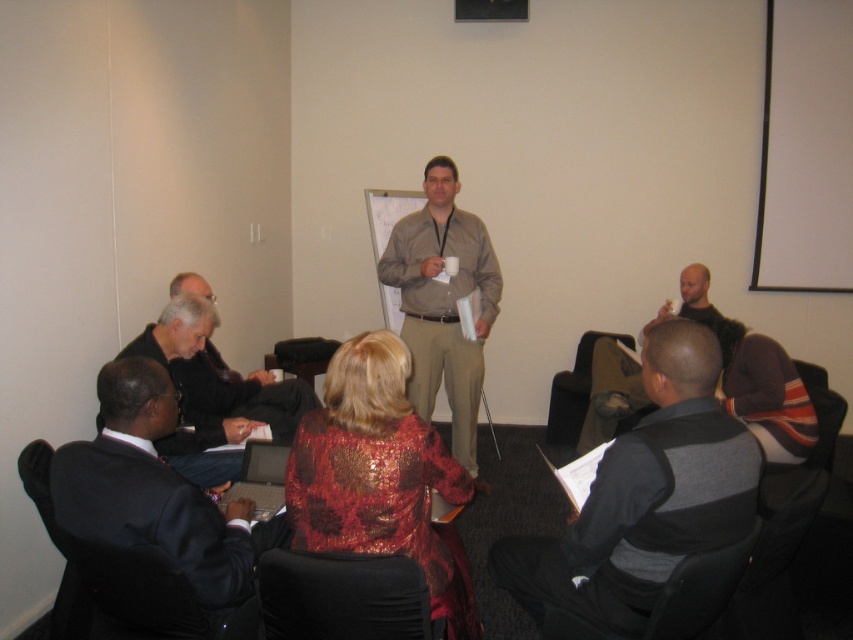
Question: Which point appears farthest from the camera in this image?

Choices:
 (A) (733, 548)
 (B) (202, 371)
 (C) (364, 520)
 (D) (78, 480)

Answer: (B)

Question: Does striped sweater at lower right appear on the left side of brown fabric chair at lower center?

Choices:
 (A) yes
 (B) no

Answer: (A)

Question: Which point is closer to the camera?

Choices:
 (A) (410, 451)
 (B) (189, 278)
 (C) (599, 422)

Answer: (A)

Question: Is shiny red dress at center closer to camera compared to brown fabric chair at lower center?

Choices:
 (A) no
 (B) yes

Answer: (B)

Question: Which object is positioned closest to the dark brown leather jacket at upper right?

Choices:
 (A) brown fabric chair at lower center
 (B) black fabric chair at lower right
 (C) dark suit at lower left
 (D) matte black laptop at lower left

Answer: (A)

Question: Can you confirm if black fabric chair at lower center is positioned below dark suit at lower left?

Choices:
 (A) no
 (B) yes

Answer: (B)